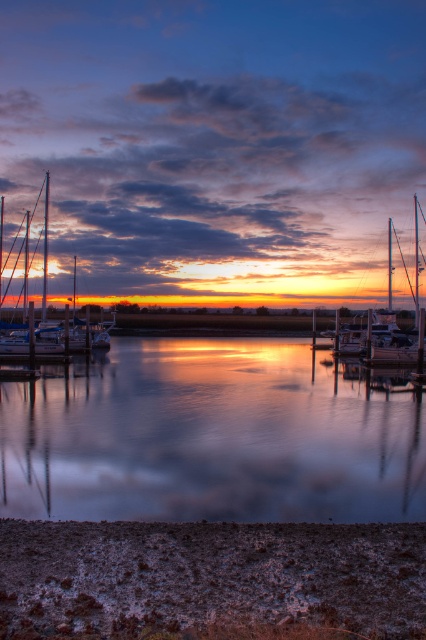
Question: Which object is closer to the camera taking this photo?

Choices:
 (A) shiny white sailboat at left
 (B) white glossy sailboat at center

Answer: (B)

Question: Does shiny white sailboat at left appear over white glossy sailboat at center?

Choices:
 (A) no
 (B) yes

Answer: (B)

Question: Is frosted grass at lower center to the right of shiny white sailboat at left from the viewer's perspective?

Choices:
 (A) no
 (B) yes

Answer: (B)

Question: Which point is closer to the camera?

Choices:
 (A) (389, 285)
 (B) (89, 541)

Answer: (B)

Question: Estimate the real-world distances between objects in this image. Which object is closer to the frosted grass at lower center?

Choices:
 (A) shiny white sailboat at left
 (B) white glossy sailboat at center

Answer: (B)

Question: Is frosted grass at lower center behind white glossy sailboat at center?

Choices:
 (A) no
 (B) yes

Answer: (A)